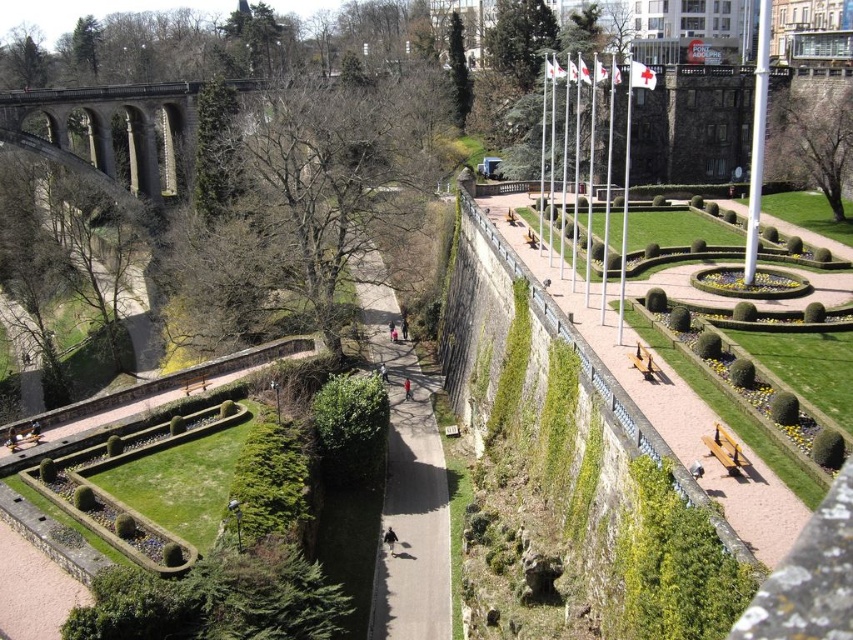
Question: Which point appears farthest from the camera in this image?

Choices:
 (A) coord(457,13)
 (B) coord(315,326)
 (C) coord(639,484)
 (D) coord(428,602)

Answer: (A)

Question: Does asphalt path at center lie in front of green leafy tree at upper right?

Choices:
 (A) no
 (B) yes

Answer: (B)

Question: Estimate the real-world distances between objects in this image. Which object is closer to the green leafy tree at upper center?

Choices:
 (A) green leafy tree at upper right
 (B) green mossy hedge at lower right
 (C) asphalt path at center

Answer: (C)

Question: Can you confirm if bare branches at center is positioned to the right of green leafy hedge at center?

Choices:
 (A) yes
 (B) no

Answer: (B)

Question: From the image, what is the correct spatial relationship of green mossy hedge at lower right in relation to green leafy tree at upper center?

Choices:
 (A) above
 (B) below

Answer: (B)

Question: Estimate the real-world distances between objects in this image. Which object is closer to the bare branches at center?

Choices:
 (A) asphalt path at center
 (B) green leafy tree at upper center

Answer: (A)